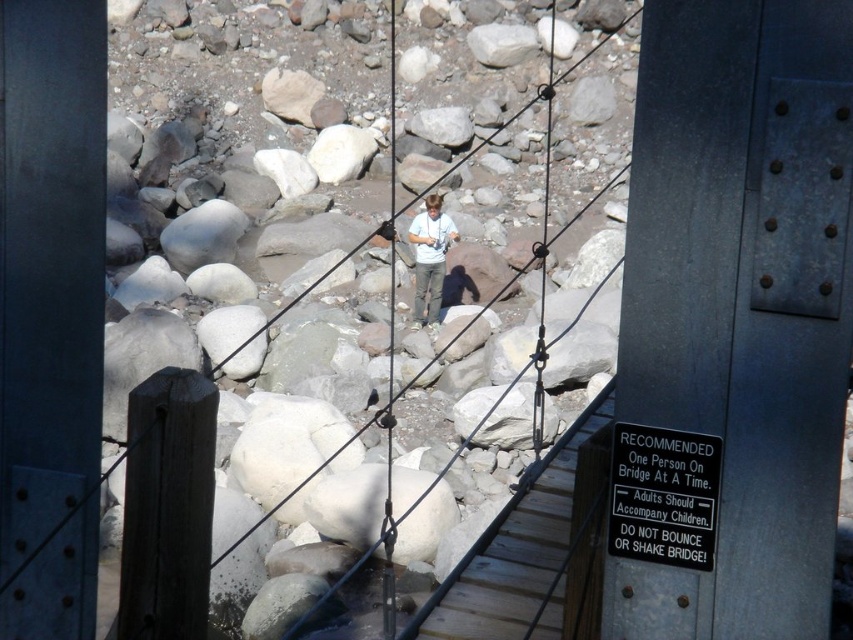
Does wooden at center have a lesser width compared to light blue shirt at center?

Incorrect, wooden at center's width is not less than light blue shirt at center's.

Is wooden at center wider than light blue shirt at center?

Yes.

Describe the element at coordinates (567, 68) in the screenshot. I see `wooden at center` at that location.

Image resolution: width=853 pixels, height=640 pixels. Find the location of `wooden at center`. wooden at center is located at coordinates (567, 68).